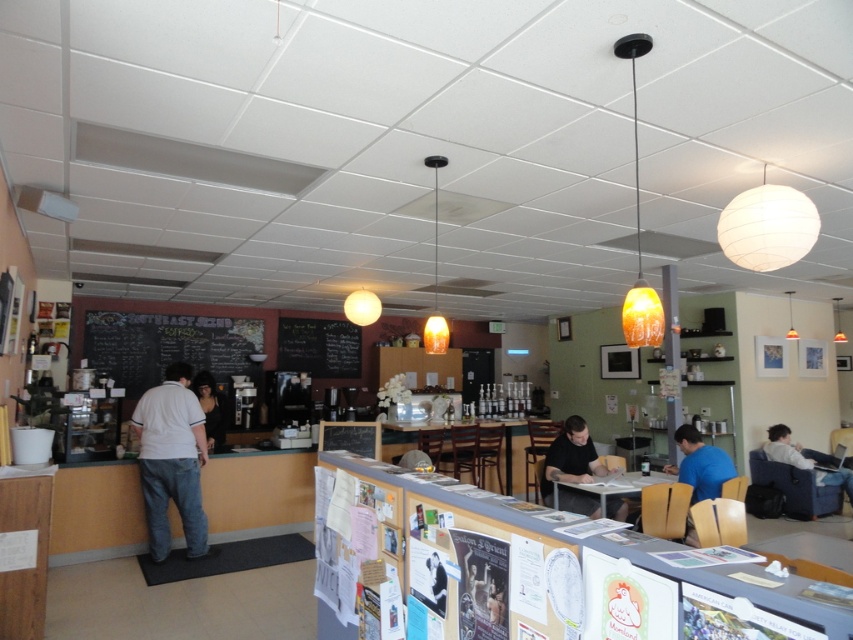
You are a customer entering the cafe and want to sit down. You see the white cotton shirt at center and the light blue fabric chair at lower right. Which object should you avoid sitting on?

You should avoid sitting on the white cotton shirt at center because it is much taller than the light blue fabric chair at lower right, indicating it is not a seating option.

You are a customer in the cafe and you want to order a drink. You notice two people at the counter area. One is wearing a white cotton shirt at center and the other is wearing a black fabric dress at center. Which person is standing closer to the floor?

The white cotton shirt at center is located below the black fabric dress at center, so the person wearing the white cotton shirt at center is standing closer to the floor.